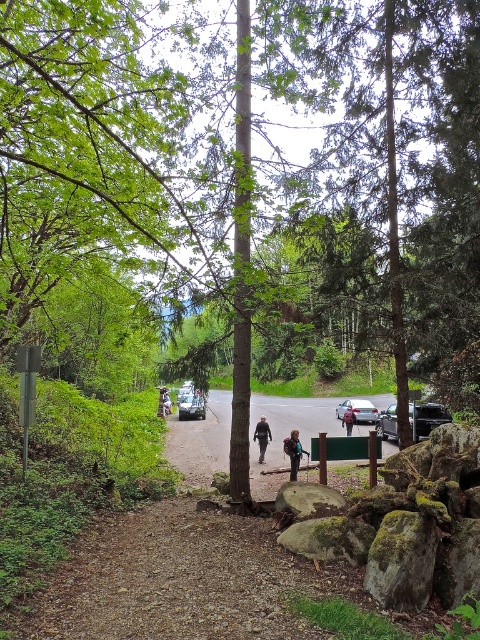
Is point (411, 422) farther from viewer compared to point (158, 406)?

That is False.

Where is `metallic gray truck at right`? This screenshot has width=480, height=640. metallic gray truck at right is located at coordinates (428, 417).

Describe the element at coordinates (191, 406) in the screenshot. I see `shiny silver car at center` at that location.

Can you confirm if shiny silver car at center is thinner than brown leather jacket at center?

Incorrect, shiny silver car at center's width is not less than brown leather jacket at center's.

Does point (193, 397) lie in front of point (169, 408)?

Yes, point (193, 397) is closer to viewer.

Where is `shiny silver car at center`? shiny silver car at center is located at coordinates (191, 406).

Describe the element at coordinates (287, 433) in the screenshot. Image resolution: width=480 pixels, height=640 pixels. I see `gravel path at center` at that location.

Does gravel path at center appear over metallic gray truck at right?

Incorrect, gravel path at center is not positioned above metallic gray truck at right.

Find the location of a particular element. gravel path at center is located at coordinates [x=287, y=433].